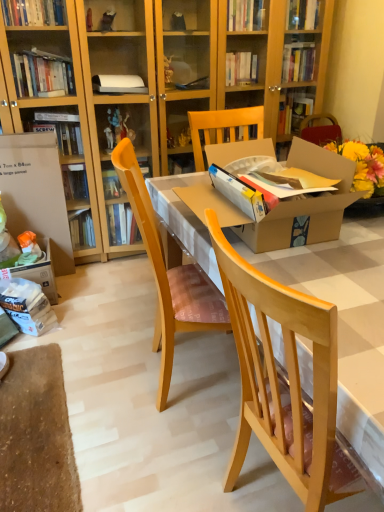
Question: Can you confirm if wooden chair at center, which ranks as the 2th chair in right-to-left order, is shorter than natural wood chair at center, the 2th chair from the left?

Choices:
 (A) yes
 (B) no

Answer: (A)

Question: From a real-world perspective, is wooden chair at center, which ranks as the 2th chair in right-to-left order, below natural wood chair at center, arranged as the first chair when viewed from the right?

Choices:
 (A) no
 (B) yes

Answer: (B)

Question: Can we say wooden chair at center, which ranks as the 2th chair in right-to-left order, lies outside natural wood chair at center, the 2th chair from the left?

Choices:
 (A) yes
 (B) no

Answer: (A)

Question: Does wooden chair at center, which ranks as the 2th chair in right-to-left order, appear on the right side of natural wood chair at center, arranged as the first chair when viewed from the right?

Choices:
 (A) no
 (B) yes

Answer: (A)

Question: Considering the relative positions of wooden chair at center, the first chair in the left-to-right sequence, and natural wood chair at center, arranged as the first chair when viewed from the right, in the image provided, is wooden chair at center, the first chair in the left-to-right sequence, in front of natural wood chair at center, arranged as the first chair when viewed from the right,?

Choices:
 (A) yes
 (B) no

Answer: (B)

Question: From a real-world perspective, is wooden chair at center, the first chair in the left-to-right sequence, positioned above or below natural wood chair at center, the 2th chair from the left?

Choices:
 (A) above
 (B) below

Answer: (B)

Question: Is wooden chair at center, which ranks as the 2th chair in right-to-left order, spatially inside natural wood chair at center, arranged as the first chair when viewed from the right, or outside of it?

Choices:
 (A) outside
 (B) inside

Answer: (A)

Question: Relative to natural wood chair at center, the 2th chair from the left, is wooden chair at center, which ranks as the 2th chair in right-to-left order, in front or behind?

Choices:
 (A) behind
 (B) front

Answer: (A)

Question: Considering the relative positions of wooden chair at center, the first chair in the left-to-right sequence, and natural wood chair at center, arranged as the first chair when viewed from the right, in the image provided, is wooden chair at center, the first chair in the left-to-right sequence, to the left or to the right of natural wood chair at center, arranged as the first chair when viewed from the right,?

Choices:
 (A) left
 (B) right

Answer: (A)

Question: Would you say cardboard box at left is to the left or to the right of natural wood chair at center, the 2th chair from the left, in the picture?

Choices:
 (A) right
 (B) left

Answer: (B)

Question: From the image's perspective, is cardboard box at left located above or below natural wood chair at center, arranged as the first chair when viewed from the right?

Choices:
 (A) above
 (B) below

Answer: (A)

Question: Is point (36, 216) positioned closer to the camera than point (236, 346)?

Choices:
 (A) closer
 (B) farther

Answer: (B)

Question: Is cardboard box at left in front of or behind natural wood chair at center, arranged as the first chair when viewed from the right, in the image?

Choices:
 (A) behind
 (B) front

Answer: (A)

Question: In terms of height, does wooden chair at center, which ranks as the 2th chair in right-to-left order, look taller or shorter compared to cardboard box at left?

Choices:
 (A) short
 (B) tall

Answer: (B)

Question: Looking at their shapes, would you say wooden chair at center, which ranks as the 2th chair in right-to-left order, is wider or thinner than cardboard box at left?

Choices:
 (A) thin
 (B) wide

Answer: (B)